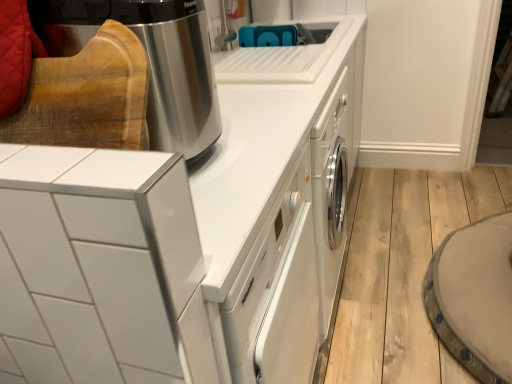
Question: Is stainless steel coffee maker at upper left, the first home appliance positioned from the top, completely or partially inside white glossy cabinet at upper left, the 2th home appliance when ordered from top to bottom?

Choices:
 (A) yes
 (B) no

Answer: (B)

Question: Can you confirm if white glossy cabinet at upper left, the 2th home appliance when ordered from top to bottom, is smaller than stainless steel coffee maker at upper left, the first home appliance positioned from the top?

Choices:
 (A) no
 (B) yes

Answer: (A)

Question: Considering the relative sizes of white glossy cabinet at upper left, which ranks as the 2th home appliance in bottom-to-top order, and stainless steel coffee maker at upper left, which ranks as the 3th home appliance in bottom-to-top order, in the image provided, is white glossy cabinet at upper left, which ranks as the 2th home appliance in bottom-to-top order, thinner than stainless steel coffee maker at upper left, which ranks as the 3th home appliance in bottom-to-top order,?

Choices:
 (A) no
 (B) yes

Answer: (B)

Question: Is white glossy cabinet at upper left, the 2th home appliance when ordered from top to bottom, positioned behind stainless steel coffee maker at upper left, which ranks as the 3th home appliance in bottom-to-top order?

Choices:
 (A) yes
 (B) no

Answer: (B)

Question: Is white glossy cabinet at upper left, which ranks as the 2th home appliance in bottom-to-top order, taller than stainless steel coffee maker at upper left, the first home appliance positioned from the top?

Choices:
 (A) no
 (B) yes

Answer: (B)

Question: From a real-world perspective, does white glossy cabinet at upper left, the 2th home appliance when ordered from top to bottom, stand above stainless steel coffee maker at upper left, the first home appliance positioned from the top?

Choices:
 (A) yes
 (B) no

Answer: (B)

Question: Is stainless steel coffee maker at upper left, the first home appliance positioned from the top, smaller than white glossy cabinet at upper left, the 2th home appliance when ordered from top to bottom?

Choices:
 (A) no
 (B) yes

Answer: (B)

Question: Is stainless steel coffee maker at upper left, which ranks as the 3th home appliance in bottom-to-top order, closer to the viewer compared to white glossy cabinet at upper left, the 2th home appliance when ordered from top to bottom?

Choices:
 (A) no
 (B) yes

Answer: (A)

Question: Does stainless steel coffee maker at upper left, the first home appliance positioned from the top, have a greater height compared to white glossy cabinet at upper left, the 2th home appliance when ordered from top to bottom?

Choices:
 (A) yes
 (B) no

Answer: (B)

Question: From a real-world perspective, is stainless steel coffee maker at upper left, the first home appliance positioned from the top, over white glossy cabinet at upper left, the 2th home appliance when ordered from top to bottom?

Choices:
 (A) no
 (B) yes

Answer: (B)

Question: Does stainless steel coffee maker at upper left, which ranks as the 3th home appliance in bottom-to-top order, have a lesser width compared to white glossy cabinet at upper left, the 2th home appliance when ordered from top to bottom?

Choices:
 (A) no
 (B) yes

Answer: (A)

Question: Is stainless steel coffee maker at upper left, the first home appliance positioned from the top, turned away from white glossy cabinet at upper left, the 2th home appliance when ordered from top to bottom?

Choices:
 (A) yes
 (B) no

Answer: (B)

Question: Are white glossy dishwasher at center, arranged as the 1th home appliance when ordered from the bottom, and white glossy cabinet at upper left, which ranks as the 2th home appliance in bottom-to-top order, making contact?

Choices:
 (A) yes
 (B) no

Answer: (B)